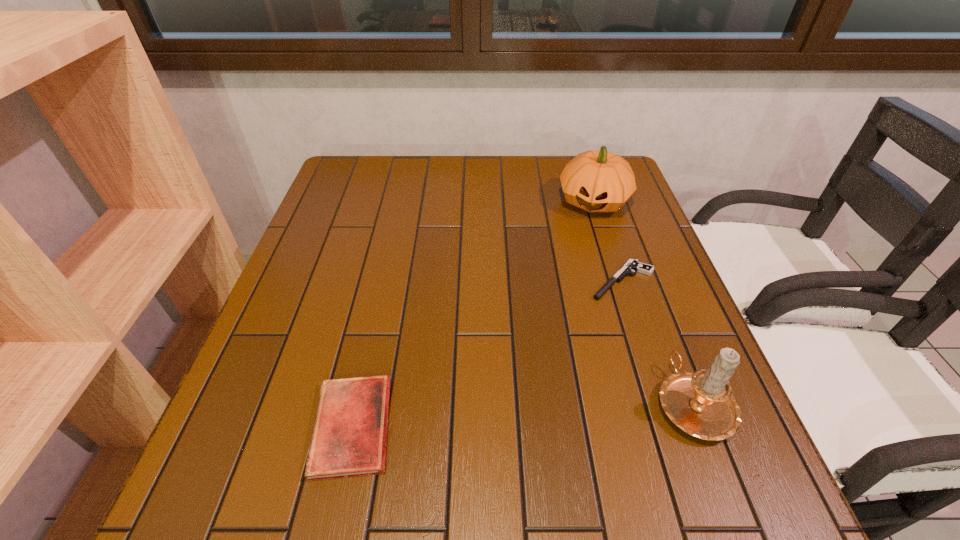
Locate an element on the screen. Image resolution: width=960 pixels, height=540 pixels. gourd at the right edge is located at coordinates tap(595, 181).

Where is `object that is positioned at the near left corner`? The height and width of the screenshot is (540, 960). object that is positioned at the near left corner is located at coordinates (349, 438).

This screenshot has height=540, width=960. I want to click on object situated at the far right corner, so click(x=595, y=181).

Where is `object that is at the near right corner`? object that is at the near right corner is located at coordinates (701, 403).

In the image, there is a desktop. Identify the location of vacant space at the far edge. This screenshot has height=540, width=960. 471,171.

Locate an element on the screen. The width and height of the screenshot is (960, 540). free location at the near edge is located at coordinates coord(616,418).

Locate an element on the screen. This screenshot has width=960, height=540. vacant space at the left edge of the desktop is located at coordinates (316, 366).

In the image, there is a desktop. Where is `blank space at the right edge`? This screenshot has width=960, height=540. blank space at the right edge is located at coordinates (640, 256).

The height and width of the screenshot is (540, 960). Find the location of `vacant region at the far left corner`. vacant region at the far left corner is located at coordinates (375, 163).

Find the location of a particular element. The width and height of the screenshot is (960, 540). vacant space at the near right corner of the desktop is located at coordinates (665, 421).